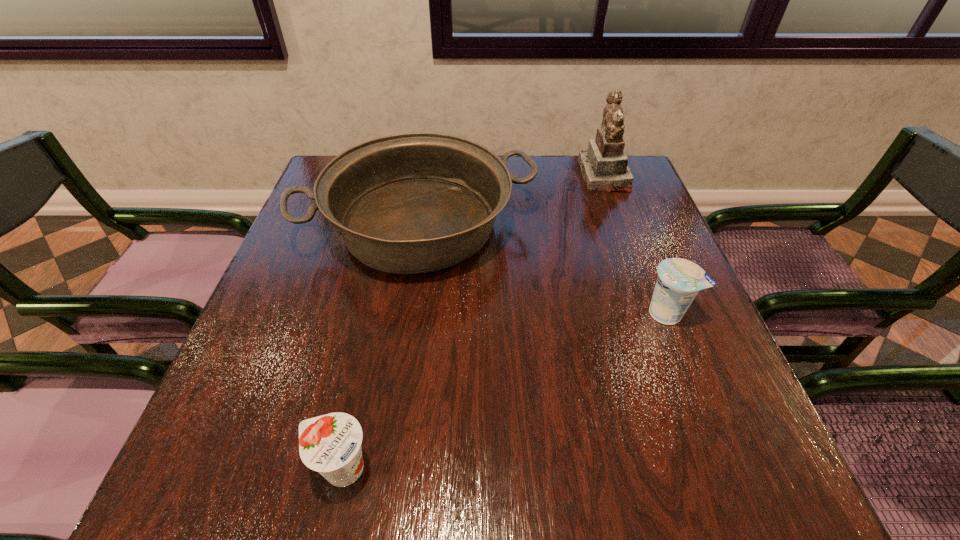
Locate an element on the screen. Image resolution: width=960 pixels, height=540 pixels. the tallest object is located at coordinates (604, 166).

In order to click on pan in this screenshot , I will do `click(410, 203)`.

Locate an element on the screen. This screenshot has width=960, height=540. the farther yogurt is located at coordinates (679, 280).

You are a GUI agent. You are given a task and a screenshot of the screen. Output one action in this format:
    pyautogui.click(x=<x>, y=<y>)
    Task: Click on the second shortest object
    The width and height of the screenshot is (960, 540).
    Given the screenshot: What is the action you would take?
    pyautogui.click(x=679, y=280)

At what (x,y) coordinates should I click in order to perform the action: click on the shorter yogurt. Please return your answer as a coordinate pair (x, y). The height and width of the screenshot is (540, 960). Looking at the image, I should click on (331, 444).

The image size is (960, 540). What are the coordinates of `the left yogurt` in the screenshot? It's located at (331, 444).

Where is `vacant space situated 0.120m on the front-facing side of the figurine`? vacant space situated 0.120m on the front-facing side of the figurine is located at coordinates (x=540, y=176).

Identify the location of vacant space located on the front-facing side of the figurine. Image resolution: width=960 pixels, height=540 pixels. (446, 176).

This screenshot has width=960, height=540. In order to click on free region located on the front-facing side of the figurine in this screenshot , I will do `click(450, 176)`.

Locate an element on the screen. This screenshot has width=960, height=540. vacant space situated on the front of the pan is located at coordinates (403, 330).